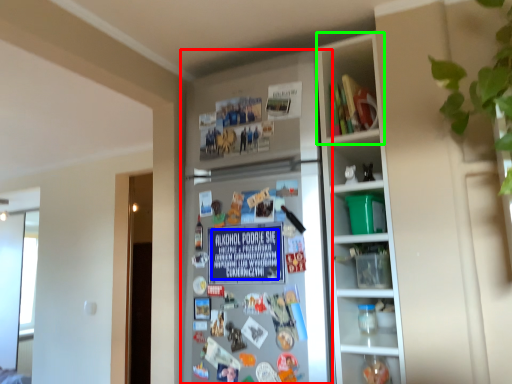
Question: Which object is the farthest from fridge (highlighted by a red box)? Choose among these: writing (highlighted by a blue box) or cabinet (highlighted by a green box).

Choices:
 (A) writing
 (B) cabinet

Answer: (B)